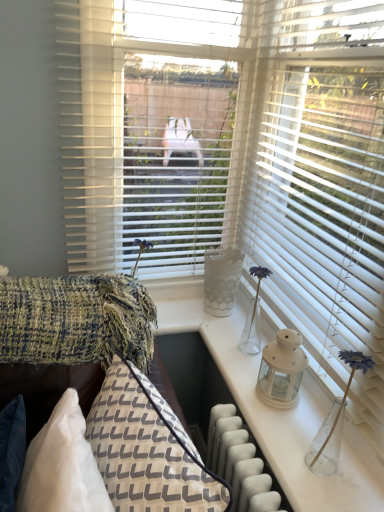
Question: From their relative heights in the image, would you say white matte lantern at center is taller or shorter than textured woven couch at lower left?

Choices:
 (A) short
 (B) tall

Answer: (A)

Question: From the image's perspective, is white matte lantern at center positioned above or below textured woven couch at lower left?

Choices:
 (A) below
 (B) above

Answer: (B)

Question: Which is farther from the white matte blinds at right?

Choices:
 (A) matte white lantern at right
 (B) white matte lantern at center
 (C) textured woolen blanket at left
 (D) textured woven couch at lower left
 (E) textured woven pillow at lower left

Answer: (E)

Question: Based on their relative distances, which object is farther from the matte white lantern at right?

Choices:
 (A) textured woolen blanket at left
 (B) textured woven pillow at lower left
 (C) textured woven couch at lower left
 (D) white matte blinds at right
 (E) white matte lantern at center

Answer: (A)